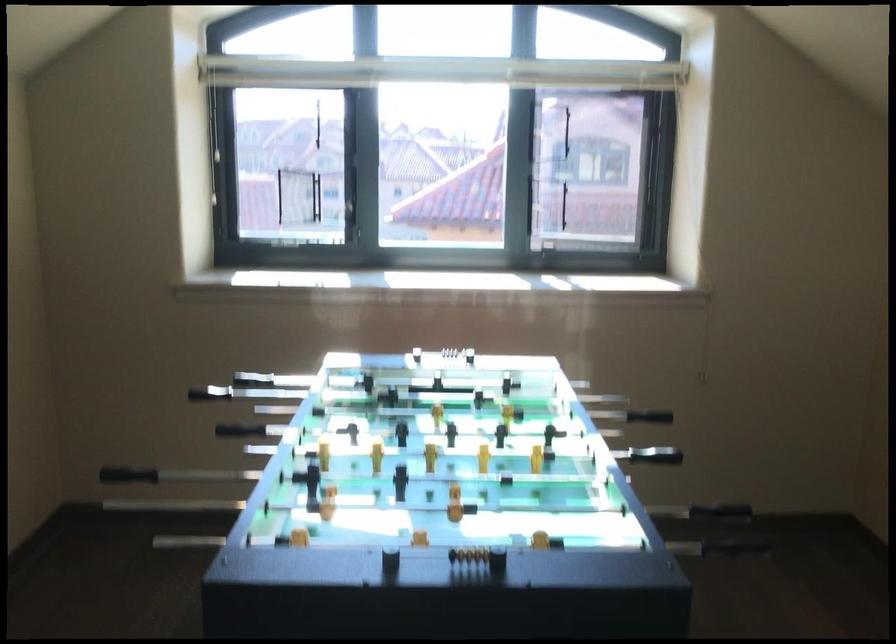
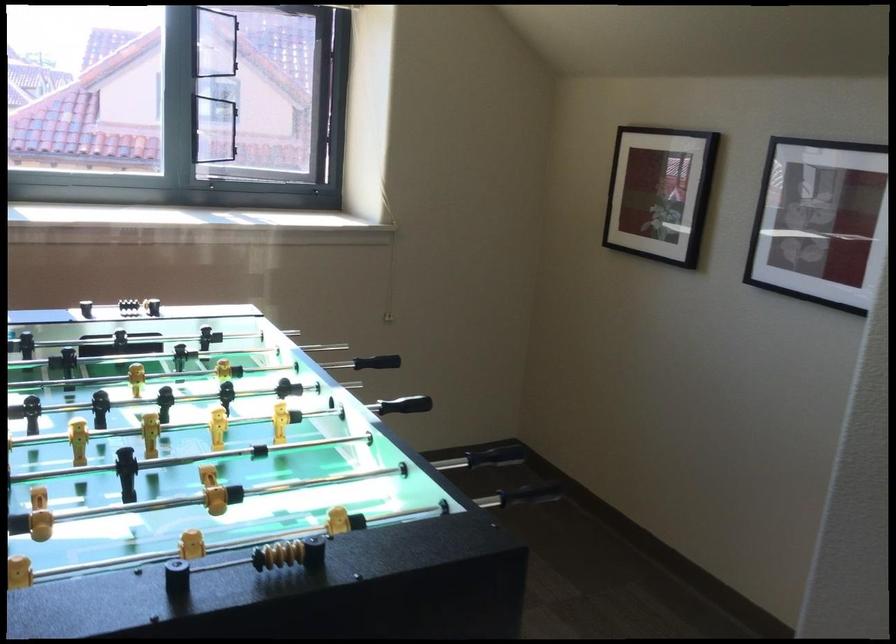
Where in the second image is the point corresponding to point (691, 422) from the first image?

(376, 362)